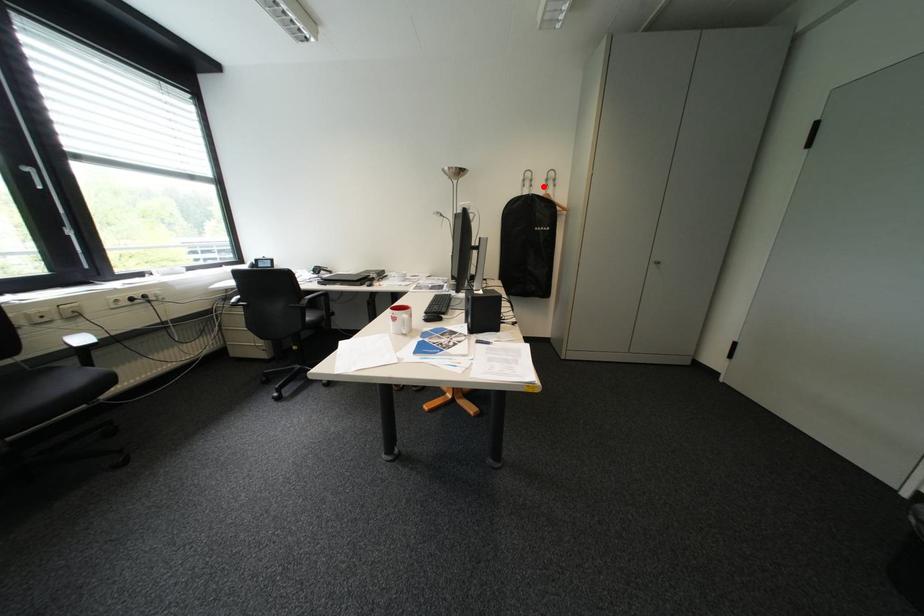
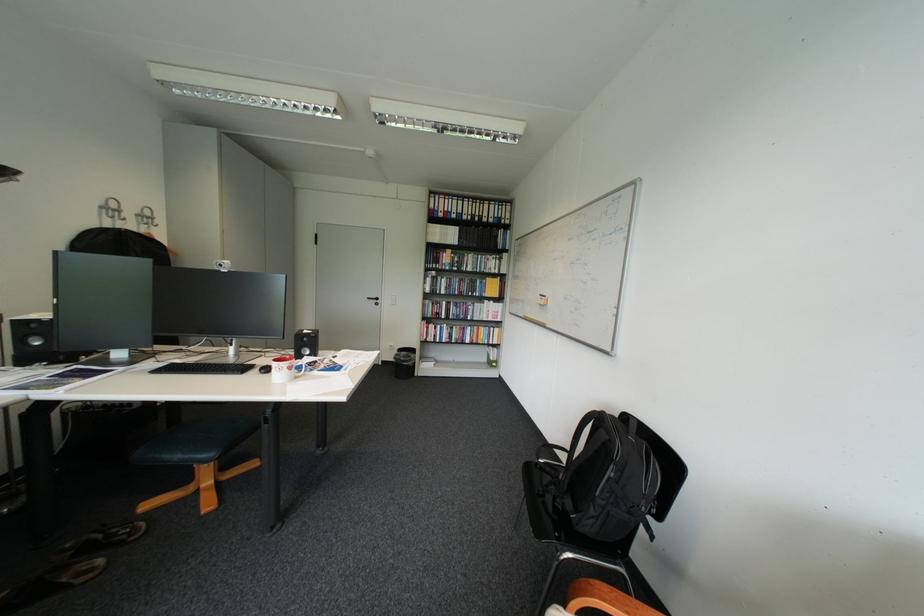
Question: I am providing you with two images of the same scene from different viewpoints. Image1 has a red point marked. In image2, the corresponding 3D location appears at what relative position? Reply with the corresponding letter.

Choices:
 (A) Closer
 (B) Farther

Answer: (B)